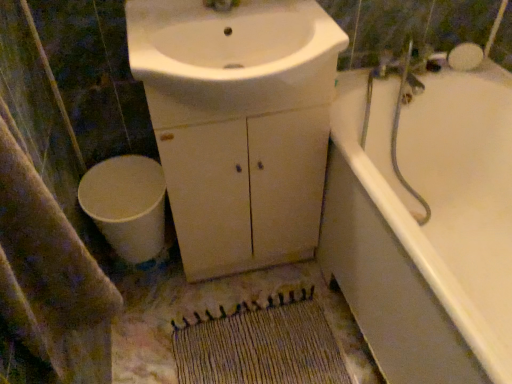
Question: Is white glossy bathtub at right positioned beyond the bounds of beige textured bath towel at lower left?

Choices:
 (A) yes
 (B) no

Answer: (A)

Question: From the image's perspective, is white glossy bathtub at right located above beige textured bath towel at lower left?

Choices:
 (A) yes
 (B) no

Answer: (B)

Question: Is white glossy bathtub at right shorter than beige textured bath towel at lower left?

Choices:
 (A) no
 (B) yes

Answer: (B)

Question: Can you confirm if white glossy bathtub at right is bigger than beige textured bath towel at lower left?

Choices:
 (A) yes
 (B) no

Answer: (A)

Question: From a real-world perspective, is white glossy bathtub at right on beige textured bath towel at lower left?

Choices:
 (A) yes
 (B) no

Answer: (B)

Question: Is beige textured bath towel at lower left at the back of white glossy bathtub at right?

Choices:
 (A) no
 (B) yes

Answer: (A)

Question: Is woven beige mat at lower center to the right of white matte toilet at lower left from the viewer's perspective?

Choices:
 (A) yes
 (B) no

Answer: (A)

Question: Considering the relative sizes of woven beige mat at lower center and white matte toilet at lower left in the image provided, is woven beige mat at lower center thinner than white matte toilet at lower left?

Choices:
 (A) no
 (B) yes

Answer: (A)

Question: Is woven beige mat at lower center in front of white matte toilet at lower left?

Choices:
 (A) yes
 (B) no

Answer: (A)

Question: Does woven beige mat at lower center have a smaller size compared to white matte toilet at lower left?

Choices:
 (A) no
 (B) yes

Answer: (B)

Question: Is white matte toilet at lower left located within woven beige mat at lower center?

Choices:
 (A) no
 (B) yes

Answer: (A)

Question: Does woven beige mat at lower center have a greater height compared to white matte toilet at lower left?

Choices:
 (A) no
 (B) yes

Answer: (A)

Question: Is white matte toilet at lower left thinner than beige textured bath towel at lower left?

Choices:
 (A) no
 (B) yes

Answer: (A)